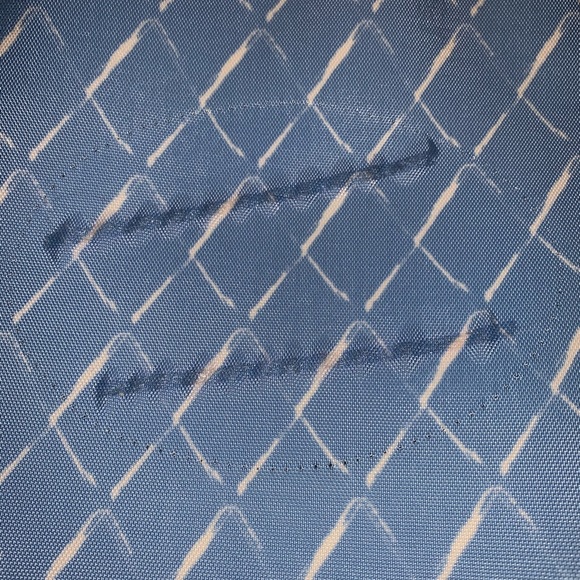
Find the location of a particular element. This screenshot has height=580, width=580. fabric is located at coordinates (509, 538).